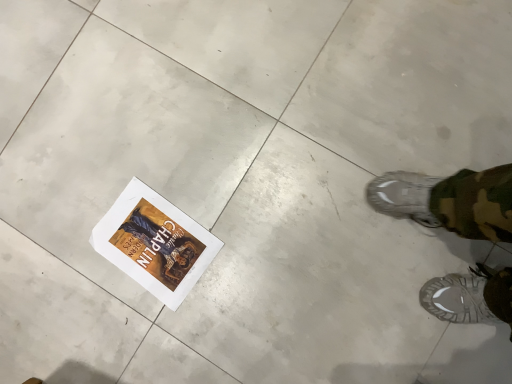
At what (x,y) coordinates should I click in order to perform the action: click on vacant area that is situated to the right of white paper postcard at lower left. Please return your answer as a coordinate pair (x, y). Image resolution: width=512 pixels, height=384 pixels. Looking at the image, I should click on click(x=214, y=172).